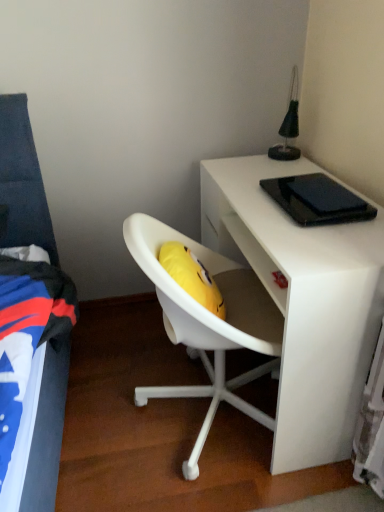
Locate an element on the screen. white matte desk at upper right is located at coordinates (303, 302).

The image size is (384, 512). Describe the element at coordinates (303, 302) in the screenshot. I see `white matte desk at upper right` at that location.

I want to click on white matte desk at upper right, so click(303, 302).